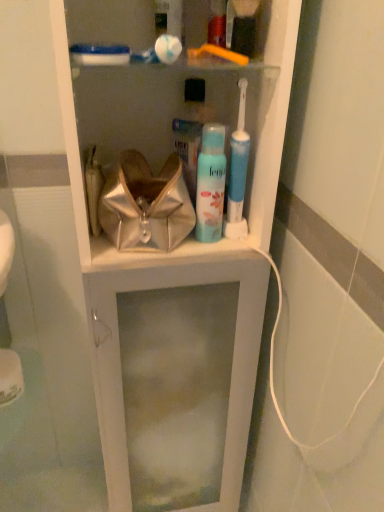
Question: Can you confirm if blue matte spray can at center is positioned to the left of metallic shiny handbag at center?

Choices:
 (A) yes
 (B) no

Answer: (B)

Question: Is blue matte spray can at center touching metallic shiny handbag at center?

Choices:
 (A) yes
 (B) no

Answer: (A)

Question: Does blue matte spray can at center have a lesser height compared to metallic shiny handbag at center?

Choices:
 (A) no
 (B) yes

Answer: (A)

Question: Is blue matte spray can at center to the right of metallic shiny handbag at center from the viewer's perspective?

Choices:
 (A) no
 (B) yes

Answer: (B)

Question: Is blue matte spray can at center thinner than metallic shiny handbag at center?

Choices:
 (A) no
 (B) yes

Answer: (B)

Question: Is blue matte spray can at center smaller than metallic shiny handbag at center?

Choices:
 (A) yes
 (B) no

Answer: (A)

Question: Can you confirm if metallic shiny handbag at center is positioned to the right of blue matte spray can at center?

Choices:
 (A) yes
 (B) no

Answer: (B)

Question: Does metallic shiny handbag at center lie in front of blue matte spray can at center?

Choices:
 (A) no
 (B) yes

Answer: (B)

Question: Is metallic shiny handbag at center wider than blue matte spray can at center?

Choices:
 (A) yes
 (B) no

Answer: (A)

Question: Considering the relative positions of metallic shiny handbag at center and blue matte spray can at center in the image provided, is metallic shiny handbag at center behind blue matte spray can at center?

Choices:
 (A) no
 (B) yes

Answer: (A)

Question: Is metallic shiny handbag at center facing towards blue matte spray can at center?

Choices:
 (A) no
 (B) yes

Answer: (A)

Question: Is blue matte spray can at center surrounded by metallic shiny handbag at center?

Choices:
 (A) yes
 (B) no

Answer: (B)

Question: Considering the positions of blue matte spray can at center and metallic shiny handbag at center in the image, is blue matte spray can at center taller or shorter than metallic shiny handbag at center?

Choices:
 (A) short
 (B) tall

Answer: (B)